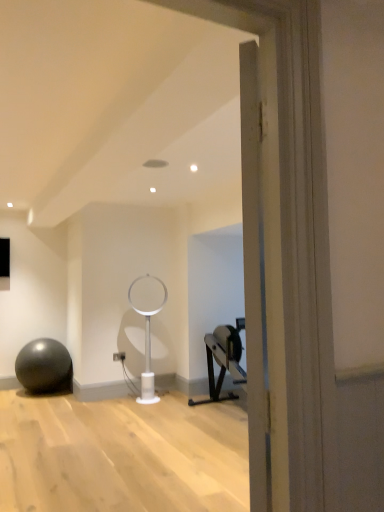
Locate an element on the screen. Image resolution: width=384 pixels, height=512 pixels. vacant space situated on the left part of white plastic table lamp at center is located at coordinates tap(124, 399).